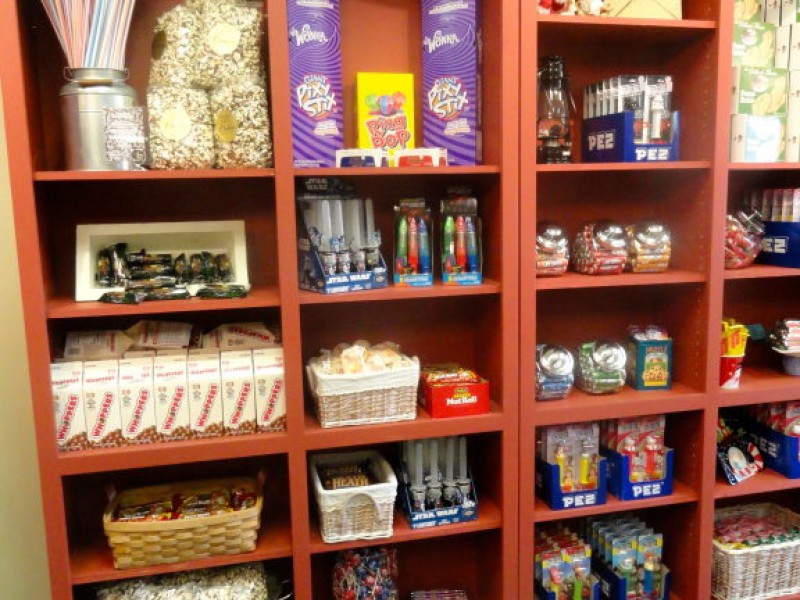
Identify the location of shelving. (150, 180), (424, 150), (585, 170), (746, 249).